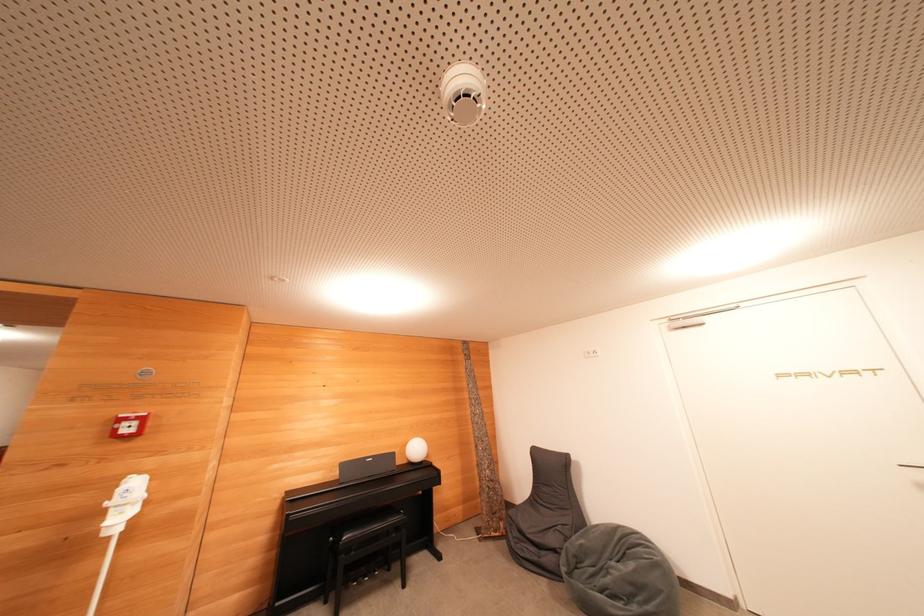
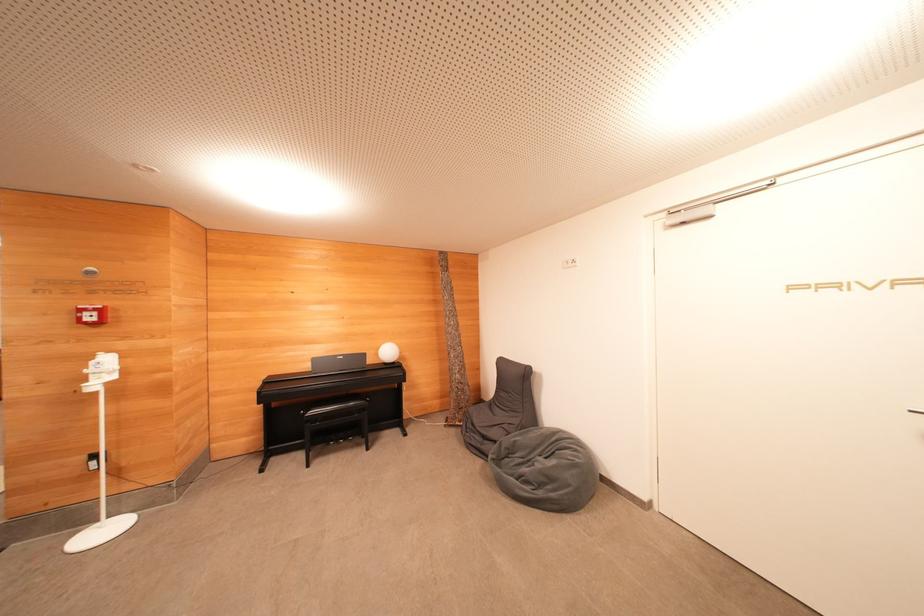
In a continuous first-person perspective shot, in which direction is the camera moving?

The cameraman walked toward right, forward.